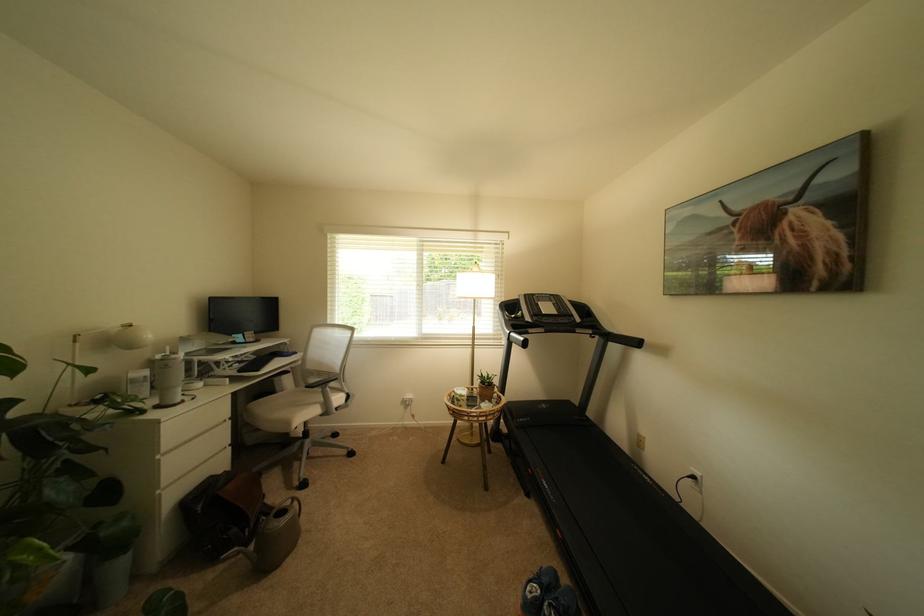
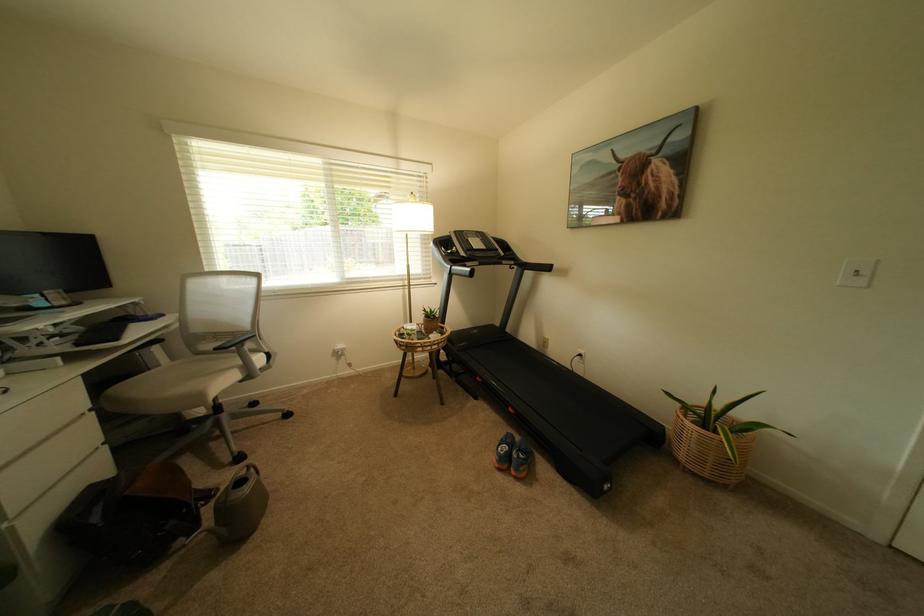
Question: The camera is either moving clockwise (left) or counter-clockwise (right) around the object. The first image is from the beginning of the video and the second image is from the end. Is the camera moving left or right when shooting the video?

Choices:
 (A) Left
 (B) Right

Answer: (A)